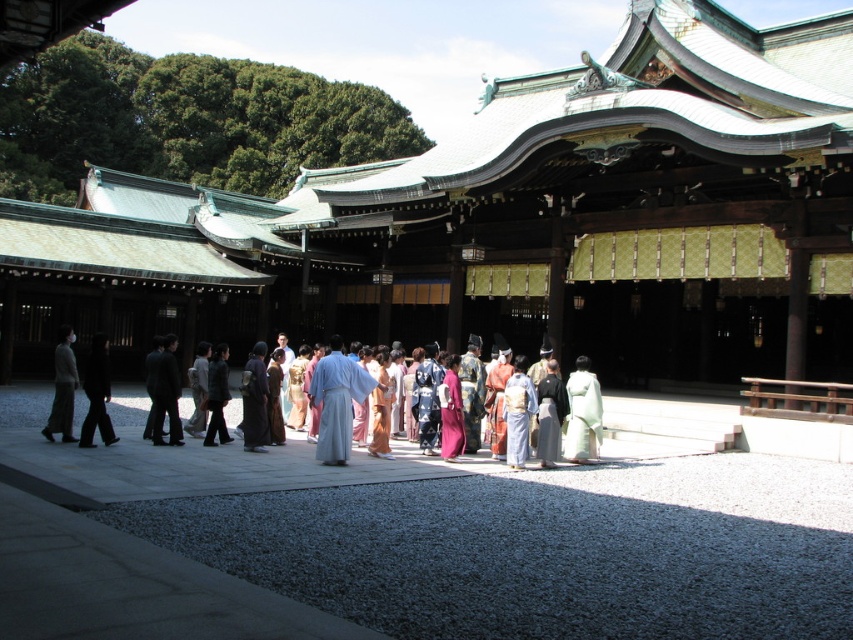
Is light blue silk robe at center shorter than white silk kimono at center?

In fact, light blue silk robe at center may be taller than white silk kimono at center.

Between point (334, 390) and point (598, 403), which one is positioned behind?

Positioned behind is point (598, 403).

The width and height of the screenshot is (853, 640). I want to click on light blue silk robe at center, so click(x=337, y=401).

Is white silk kimono at center below dark gray suit at center?

Correct, white silk kimono at center is located below dark gray suit at center.

Does white silk kimono at center have a greater width compared to dark gray suit at center?

No.

Which is in front, point (573, 445) or point (85, 371)?

Point (573, 445) is more forward.

You are a GUI agent. You are given a task and a screenshot of the screen. Output one action in this format:
    pyautogui.click(x=<x>, y=<y>)
    Task: Click on the white silk kimono at center
    The image size is (853, 640).
    Given the screenshot: What is the action you would take?
    pyautogui.click(x=583, y=413)

Does point (326, 365) lie in front of point (105, 368)?

Yes.

Locate an element on the screen. light blue silk robe at center is located at coordinates (337, 401).

The height and width of the screenshot is (640, 853). Identify the location of light blue silk robe at center. (337, 401).